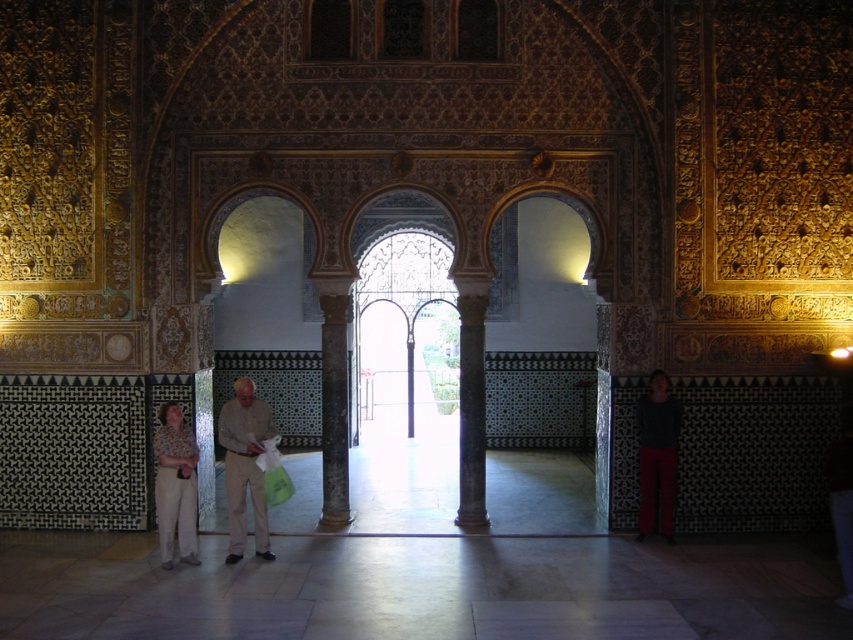
You are standing in the entrance of this ornate room and want to pick up the dark gray sweater at right. To reach it, you must first pass around the black marble column at center. Which direction should you walk around the column to face the sweater?

Since the dark gray sweater at right is behind the black marble column at center, you should walk around the column to the right side to face the sweater.

From the picture: You are standing in the center of the room and see the point marked at coordinates (471,412). What object is located at that point?

The point at coordinates (471,412) corresponds to the black marble column at center.

You are an architect designing a new building that must incorporate both traditional and modern elements. You observe the black marble column at center and the light beige pants at lower left in the image. Which object should you choose if you want to use a thinner column for structural support?

The black marble column at center is thinner than the light beige pants at lower left, so you should choose the black marble column at center for a thinner column in your design.